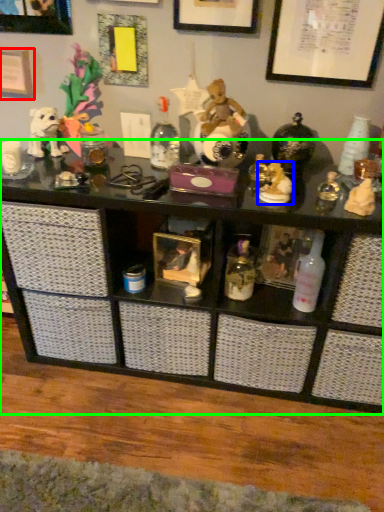
Question: Considering the real-world distances, which object is closest to picture frame (highlighted by a red box)? toy (highlighted by a blue box) or shelf (highlighted by a green box).

Choices:
 (A) toy
 (B) shelf

Answer: (B)